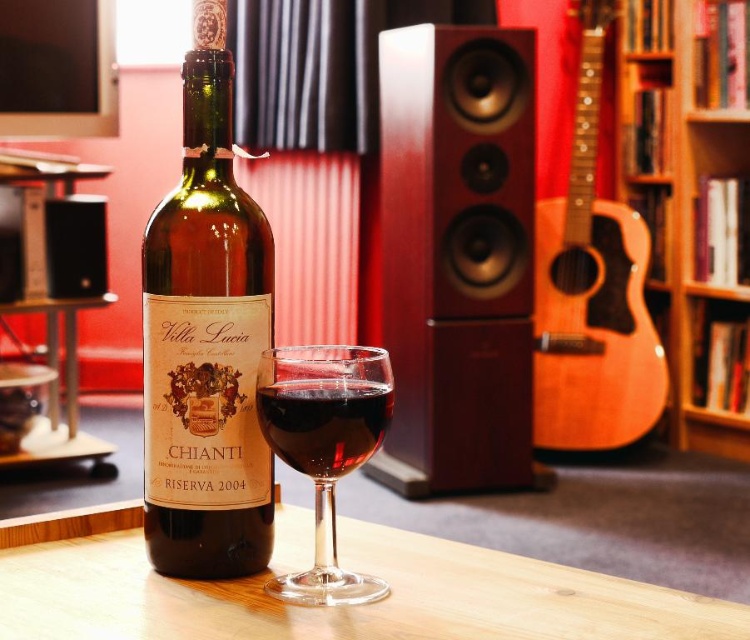
Question: Which point appears closest to the camera in this image?

Choices:
 (A) (324, 371)
 (B) (255, 611)
 (C) (573, 428)
 (D) (723, 410)

Answer: (A)

Question: Which object is closer to the camera taking this photo?

Choices:
 (A) ruby glass at center
 (B) mahogany wood speaker at center
 (C) green glass bottle at center

Answer: (A)

Question: Which point is closer to the camera taking this photo?

Choices:
 (A) (729, 150)
 (B) (384, 170)
 (C) (282, 451)

Answer: (C)

Question: Does natural wood acoustic guitar at center right have a lesser width compared to ruby glass at center?

Choices:
 (A) yes
 (B) no

Answer: (B)

Question: Can you confirm if ruby glass at center is positioned to the left of black matte speaker at lower left?

Choices:
 (A) yes
 (B) no

Answer: (B)

Question: Is green glass bottle at center bigger than ruby glass at center?

Choices:
 (A) no
 (B) yes

Answer: (B)